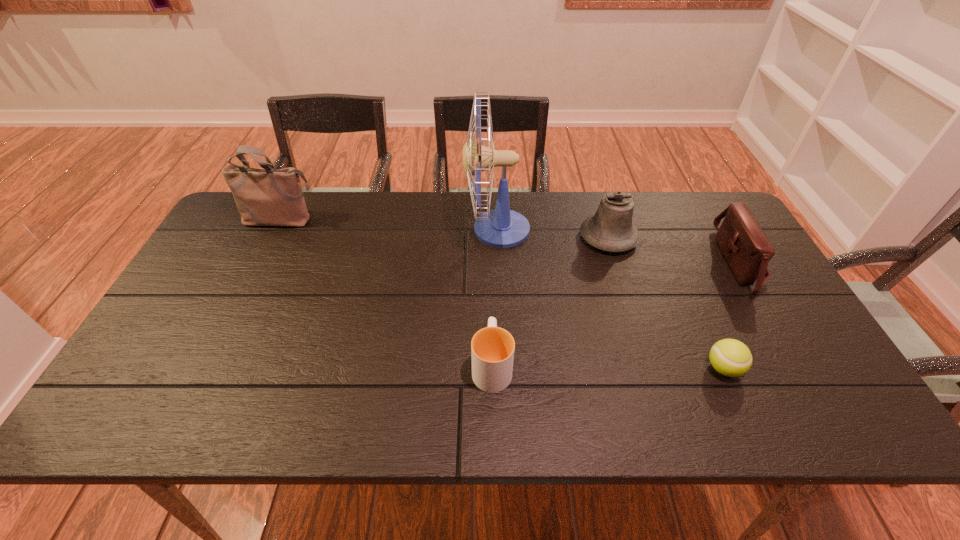
The width and height of the screenshot is (960, 540). What are the coordinates of `vacant region located 0.070m on the left of the fifth object from left to right` in the screenshot? It's located at (675, 368).

The width and height of the screenshot is (960, 540). In order to click on fan that is at the far edge in this screenshot , I will do `click(501, 227)`.

The image size is (960, 540). In order to click on bell that is at the far edge in this screenshot , I will do `click(610, 229)`.

This screenshot has width=960, height=540. I want to click on object present at the near edge, so click(x=492, y=348).

Identify the location of object present at the left edge. This screenshot has height=540, width=960. (264, 197).

I want to click on object that is positioned at the right edge, so click(746, 248).

Find the location of a particular element. This screenshot has width=960, height=540. object situated at the far left corner is located at coordinates (264, 197).

Image resolution: width=960 pixels, height=540 pixels. What are the coordinates of `object at the far right corner` in the screenshot? It's located at (746, 248).

The image size is (960, 540). In the image, there is a desktop. In order to click on free space at the far edge in this screenshot , I will do `click(673, 228)`.

Identify the location of blank area at the near edge. (625, 423).